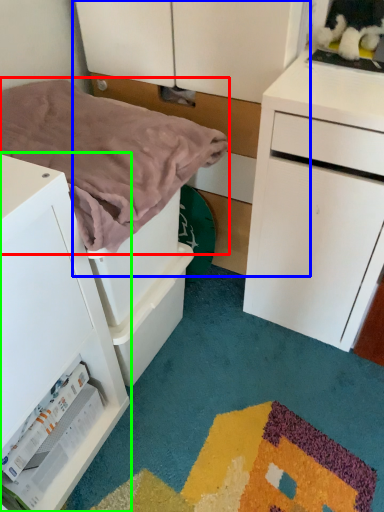
Question: Considering the real-world distances, which object is closest to blanket (highlighted by a red box)? dresser (highlighted by a blue box) or chest of drawers (highlighted by a green box).

Choices:
 (A) dresser
 (B) chest of drawers

Answer: (B)